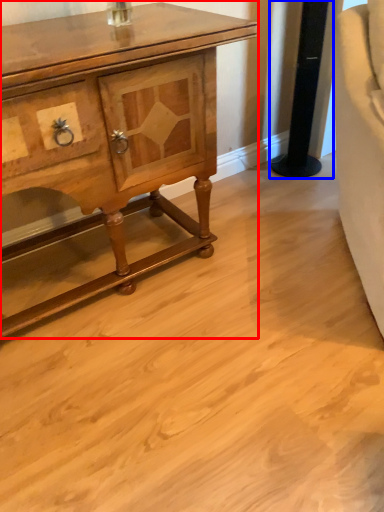
Question: Which object appears farthest to the camera in this image, chest of drawers (highlighted by a red box) or pillar (highlighted by a blue box)?

Choices:
 (A) chest of drawers
 (B) pillar

Answer: (B)